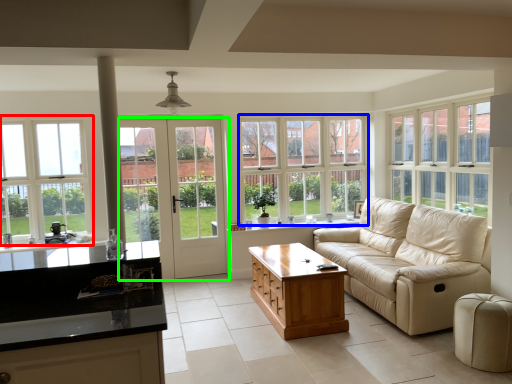
Question: Based on their relative distances, which object is farther from window (highlighted by a red box)? Choose from window (highlighted by a blue box) and door (highlighted by a green box).

Choices:
 (A) window
 (B) door

Answer: (A)